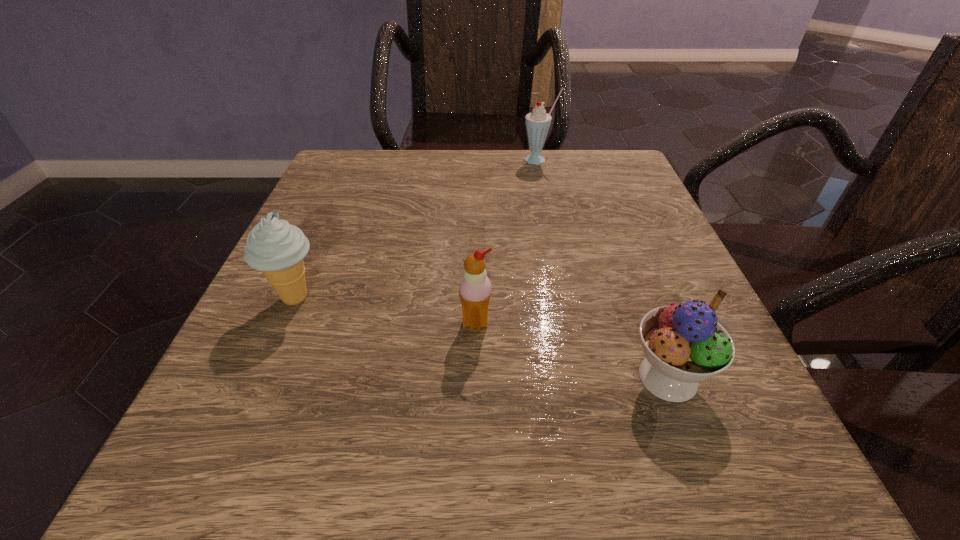
Image resolution: width=960 pixels, height=540 pixels. Find the location of `object that is at the far edge`. object that is at the far edge is located at coordinates (537, 122).

Identify the location of object present at the left edge. (275, 247).

Find the location of a particular element. This screenshot has width=960, height=540. object that is positioned at the right edge is located at coordinates (684, 344).

In the image, there is a desktop. In order to click on blank space at the far edge in this screenshot , I will do `click(468, 150)`.

Locate an element on the screen. blank area at the near edge is located at coordinates (492, 464).

Where is `vacant space at the left edge`? This screenshot has width=960, height=540. vacant space at the left edge is located at coordinates [368, 272].

Identify the location of vacant space at the right edge. The image size is (960, 540). click(592, 228).

Find the location of a particular element. free region at the far left corner is located at coordinates (336, 164).

Identify the location of free spot at the far right corner of the desktop. The width and height of the screenshot is (960, 540). (610, 179).

You are a GUI agent. You are given a task and a screenshot of the screen. Output one action in this format:
    pyautogui.click(x=<x>, y=<y>)
    Task: Click on the vacant region at the near right corner of the desktop
    The width and height of the screenshot is (960, 540).
    Given the screenshot: What is the action you would take?
    pyautogui.click(x=766, y=430)